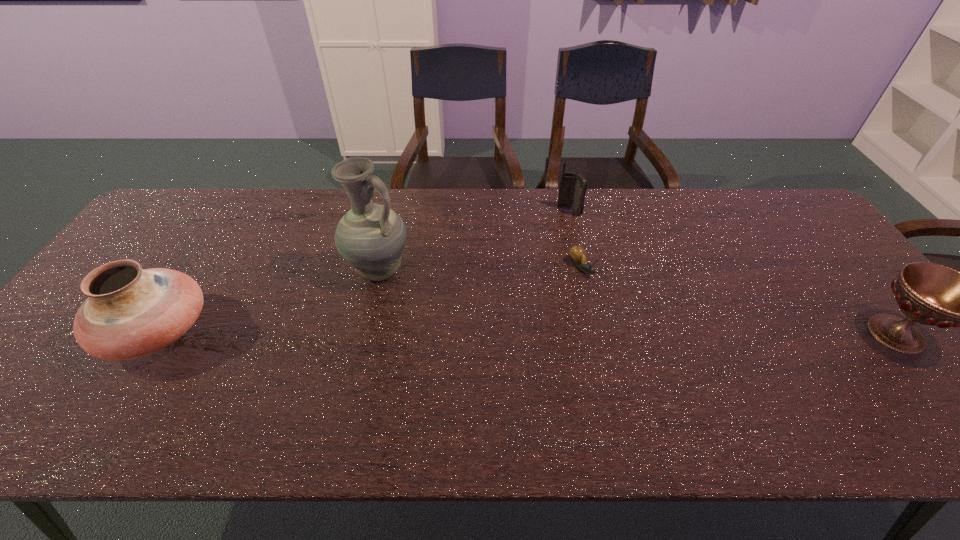
What are the coordinates of `free space located 0.160m on the front-facing side of the shortest object` in the screenshot? It's located at (624, 322).

Locate an element on the screen. This screenshot has width=960, height=540. vacant space situated on the keyboard of the cellular telephone is located at coordinates (572, 287).

Where is `vacant space located 0.250m on the keyboard of the cellular telephone`? vacant space located 0.250m on the keyboard of the cellular telephone is located at coordinates (571, 272).

The width and height of the screenshot is (960, 540). In order to click on free location located on the keyboard of the cellular telephone in this screenshot , I will do `click(572, 287)`.

Image resolution: width=960 pixels, height=540 pixels. I want to click on vacant area located 0.350m on the handle side of the second object from left to right, so click(x=468, y=383).

Locate an element on the screen. The image size is (960, 540). free space located 0.220m on the handle side of the second object from left to right is located at coordinates (438, 344).

Identify the location of free spot located 0.150m on the handle side of the second object from left to right. Image resolution: width=960 pixels, height=540 pixels. (422, 326).

At what (x,y) coordinates should I click in order to perform the action: click on object that is at the far edge. Please return your answer as a coordinate pair (x, y). Looking at the image, I should click on (573, 187).

This screenshot has width=960, height=540. In order to click on object that is at the near edge in this screenshot , I will do `click(130, 312)`.

The height and width of the screenshot is (540, 960). In order to click on object that is at the left edge in this screenshot , I will do `click(130, 312)`.